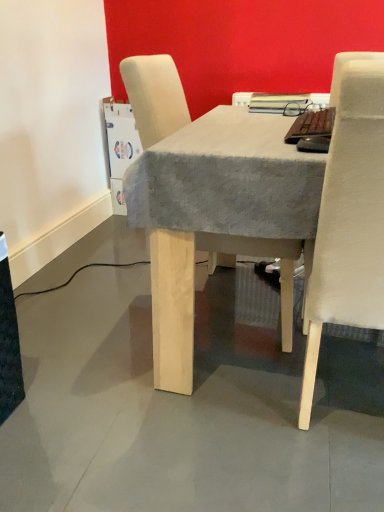
Describe the element at coordinates (155, 96) in the screenshot. I see `beige fabric chair at center, positioned as the second chair in right-to-left order` at that location.

At what (x,y) coordinates should I click in order to perform the action: click on beige fabric chair at center, the first chair in the left-to-right sequence. Please return your answer as a coordinate pair (x, y). The image size is (384, 512). Looking at the image, I should click on (155, 96).

What is the approximate width of beige fabric chair at center, the first chair in the left-to-right sequence?

The width of beige fabric chair at center, the first chair in the left-to-right sequence, is 61.16 centimeters.

How much space does beige fabric chair at center, positioned as the second chair in right-to-left order, occupy vertically?

beige fabric chair at center, positioned as the second chair in right-to-left order, is 37.87 inches in height.

What do you see at coordinates (349, 214) in the screenshot? This screenshot has height=512, width=384. I see `beige fabric chair at right, placed as the first chair when sorted from right to left` at bounding box center [349, 214].

Image resolution: width=384 pixels, height=512 pixels. Identify the location of beige fabric chair at right, placed as the first chair when sorted from right to left. (349, 214).

This screenshot has height=512, width=384. Identify the location of beige fabric chair at center, positioned as the second chair in right-to-left order. (155, 96).

Is beige fabric chair at right, arranged as the 2th chair when viewed from the left, to the left of beige fabric chair at center, positioned as the second chair in right-to-left order, from the viewer's perspective?

No.

Which object is closer to the camera taking this photo, beige fabric chair at right, arranged as the 2th chair when viewed from the left, or beige fabric chair at center, the first chair in the left-to-right sequence?

Positioned in front is beige fabric chair at right, arranged as the 2th chair when viewed from the left.

Is point (334, 209) closer to camera compared to point (141, 88)?

Yes, it is in front of point (141, 88).

From the image's perspective, which one is positioned higher, beige fabric chair at right, arranged as the 2th chair when viewed from the left, or beige fabric chair at center, positioned as the second chair in right-to-left order?

beige fabric chair at center, positioned as the second chair in right-to-left order.

From a real-world perspective, which object stands above the other?

beige fabric chair at right, arranged as the 2th chair when viewed from the left, is physically above.

Is beige fabric chair at right, placed as the first chair when sorted from right to left, wider than beige fabric chair at center, positioned as the second chair in right-to-left order?

No, beige fabric chair at right, placed as the first chair when sorted from right to left, is not wider than beige fabric chair at center, positioned as the second chair in right-to-left order.

Considering the sizes of objects beige fabric chair at right, arranged as the 2th chair when viewed from the left, and beige fabric chair at center, the first chair in the left-to-right sequence, in the image provided, who is shorter, beige fabric chair at right, arranged as the 2th chair when viewed from the left, or beige fabric chair at center, the first chair in the left-to-right sequence,?

With less height is beige fabric chair at center, the first chair in the left-to-right sequence.

Considering the sizes of objects beige fabric chair at right, placed as the first chair when sorted from right to left, and beige fabric chair at center, positioned as the second chair in right-to-left order, in the image provided, who is bigger, beige fabric chair at right, placed as the first chair when sorted from right to left, or beige fabric chair at center, positioned as the second chair in right-to-left order,?

Bigger between the two is beige fabric chair at center, positioned as the second chair in right-to-left order.

In the scene shown: Is beige fabric chair at right, placed as the first chair when sorted from right to left, not within beige fabric chair at center, positioned as the second chair in right-to-left order?

Indeed, beige fabric chair at right, placed as the first chair when sorted from right to left, is completely outside beige fabric chair at center, positioned as the second chair in right-to-left order.

Is beige fabric chair at right, arranged as the 2th chair when viewed from the left, in contact with beige fabric chair at center, positioned as the second chair in right-to-left order?

No, beige fabric chair at right, arranged as the 2th chair when viewed from the left, is not in contact with beige fabric chair at center, positioned as the second chair in right-to-left order.

Is beige fabric chair at right, placed as the first chair when sorted from right to left, facing towards beige fabric chair at center, positioned as the second chair in right-to-left order?

No.

Measure the distance between beige fabric chair at right, arranged as the 2th chair when viewed from the left, and beige fabric chair at center, positioned as the second chair in right-to-left order.

26.09 inches.

This screenshot has height=512, width=384. Identify the location of chair below the beige fabric chair at right, arranged as the 2th chair when viewed from the left (from a real-world perspective). (155, 96).

Visually, is beige fabric chair at center, positioned as the second chair in right-to-left order, positioned to the left or to the right of beige fabric chair at right, placed as the first chair when sorted from right to left?

beige fabric chair at center, positioned as the second chair in right-to-left order, is to the left of beige fabric chair at right, placed as the first chair when sorted from right to left.

Between beige fabric chair at center, positioned as the second chair in right-to-left order, and beige fabric chair at right, arranged as the 2th chair when viewed from the left, which one is positioned behind?

beige fabric chair at center, positioned as the second chair in right-to-left order, is more distant.

Which point is more distant from viewer, (166, 135) or (365, 242)?

The point (166, 135) is more distant.

From the image's perspective, is beige fabric chair at center, the first chair in the left-to-right sequence, above or below beige fabric chair at right, arranged as the 2th chair when viewed from the left?

beige fabric chair at center, the first chair in the left-to-right sequence, is above beige fabric chair at right, arranged as the 2th chair when viewed from the left.

From a real-world perspective, which is physically below, beige fabric chair at center, the first chair in the left-to-right sequence, or beige fabric chair at right, placed as the first chair when sorted from right to left?

From a 3D spatial view, beige fabric chair at center, the first chair in the left-to-right sequence, is below.

Can you confirm if beige fabric chair at center, positioned as the second chair in right-to-left order, is wider than beige fabric chair at right, placed as the first chair when sorted from right to left?

Yes.

Between beige fabric chair at center, positioned as the second chair in right-to-left order, and beige fabric chair at right, placed as the first chair when sorted from right to left, which one has more height?

beige fabric chair at right, placed as the first chair when sorted from right to left.

In terms of size, does beige fabric chair at center, positioned as the second chair in right-to-left order, appear bigger or smaller than beige fabric chair at right, arranged as the 2th chair when viewed from the left?

In the image, beige fabric chair at center, positioned as the second chair in right-to-left order, appears to be larger than beige fabric chair at right, arranged as the 2th chair when viewed from the left.

Looking at this image, is beige fabric chair at center, the first chair in the left-to-right sequence, inside the boundaries of beige fabric chair at right, placed as the first chair when sorted from right to left, or outside?

beige fabric chair at center, the first chair in the left-to-right sequence, is not enclosed by beige fabric chair at right, placed as the first chair when sorted from right to left.

From the picture: Is beige fabric chair at center, the first chair in the left-to-right sequence, far from beige fabric chair at right, arranged as the 2th chair when viewed from the left?

They are positioned close to each other.

Does beige fabric chair at center, positioned as the second chair in right-to-left order, turn towards beige fabric chair at right, arranged as the 2th chair when viewed from the left?

No, beige fabric chair at center, positioned as the second chair in right-to-left order, is not oriented towards beige fabric chair at right, arranged as the 2th chair when viewed from the left.

Can you tell me how much beige fabric chair at center, the first chair in the left-to-right sequence, and beige fabric chair at right, placed as the first chair when sorted from right to left, differ in facing direction?

90 degrees separate the facing orientations of beige fabric chair at center, the first chair in the left-to-right sequence, and beige fabric chair at right, placed as the first chair when sorted from right to left.

Measure the distance between beige fabric chair at center, positioned as the second chair in right-to-left order, and beige fabric chair at right, placed as the first chair when sorted from right to left.

beige fabric chair at center, positioned as the second chair in right-to-left order, is 26.09 inches away from beige fabric chair at right, placed as the first chair when sorted from right to left.

Where is `chair lying on the left of beige fabric chair at right, placed as the first chair when sorted from right to left`? chair lying on the left of beige fabric chair at right, placed as the first chair when sorted from right to left is located at coordinates (155, 96).

In order to click on chair to the right of beige fabric chair at center, the first chair in the left-to-right sequence in this screenshot , I will do tap(349, 214).

The image size is (384, 512). Find the location of `chair that is below the beige fabric chair at center, the first chair in the left-to-right sequence (from the image's perspective)`. chair that is below the beige fabric chair at center, the first chair in the left-to-right sequence (from the image's perspective) is located at coordinates (349, 214).